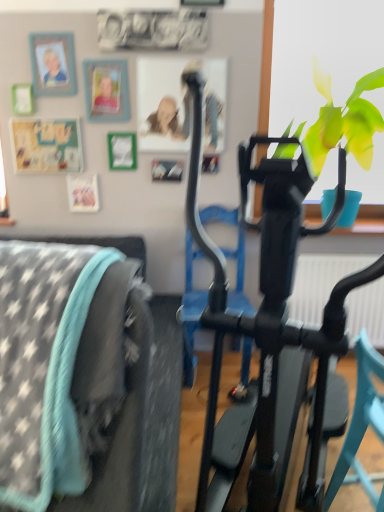
Question: From the image's perspective, is matte plastic picture frame at upper left, positioned as the 1th picture frame in right-to-left order, positioned above or below teal plastic chair at center?

Choices:
 (A) below
 (B) above

Answer: (B)

Question: Considering the positions of matte plastic picture frame at upper left, the 2th picture frame positioned from the left, and teal plastic chair at center in the image, is matte plastic picture frame at upper left, the 2th picture frame positioned from the left, wider or thinner than teal plastic chair at center?

Choices:
 (A) wide
 (B) thin

Answer: (B)

Question: Estimate the real-world distances between objects in this image. Which object is farther from the matte plastic picture frame at upper left, the 2th picture frame positioned from the left?

Choices:
 (A) teal plastic chair at center
 (B) green leafy plant at upper right
 (C) wooden photo frame at upper left, the 1th picture frame in the left-to-right sequence
 (D) black matte stationary bicycle at center

Answer: (A)

Question: Which of these objects is positioned closest to the wooden photo frame at upper left, the 1th picture frame in the left-to-right sequence?

Choices:
 (A) black matte stationary bicycle at center
 (B) matte plastic picture frame at upper left, the 2th picture frame positioned from the left
 (C) teal plastic chair at center
 (D) green leafy plant at upper right

Answer: (B)